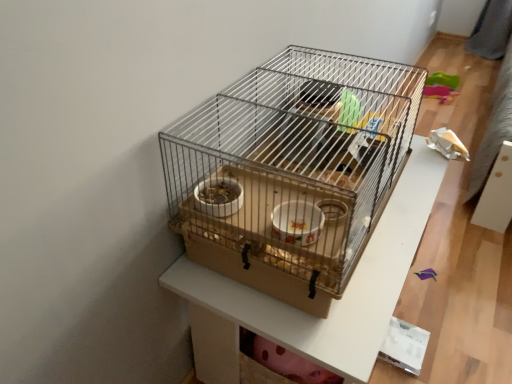
Identify the location of metal wire cage at center. This screenshot has height=384, width=512. (332, 300).

What do you see at coordinates (332, 300) in the screenshot? I see `metal wire cage at center` at bounding box center [332, 300].

The image size is (512, 384). What are the coordinates of `metal wire cage at center` in the screenshot? It's located at (332, 300).